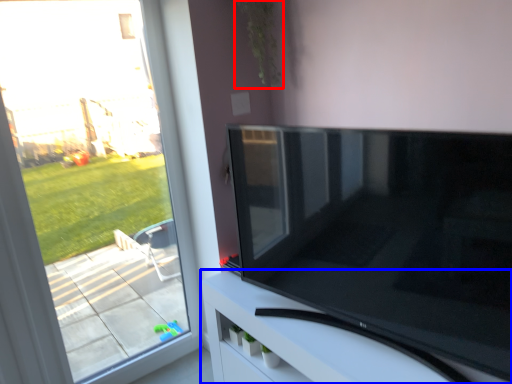
Question: Which of the following is the farthest to the observer, plant (highlighted by a red box) or furniture (highlighted by a blue box)?

Choices:
 (A) plant
 (B) furniture

Answer: (A)